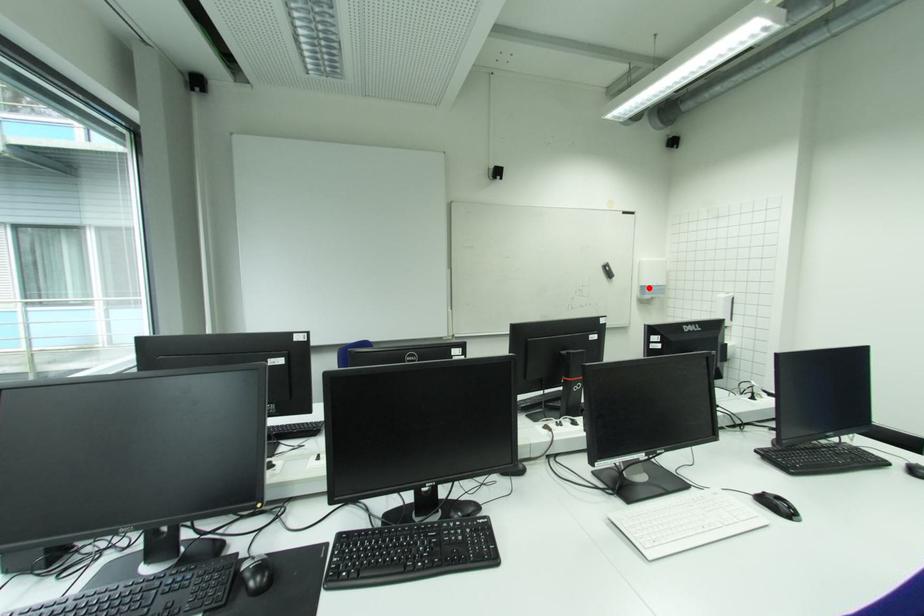
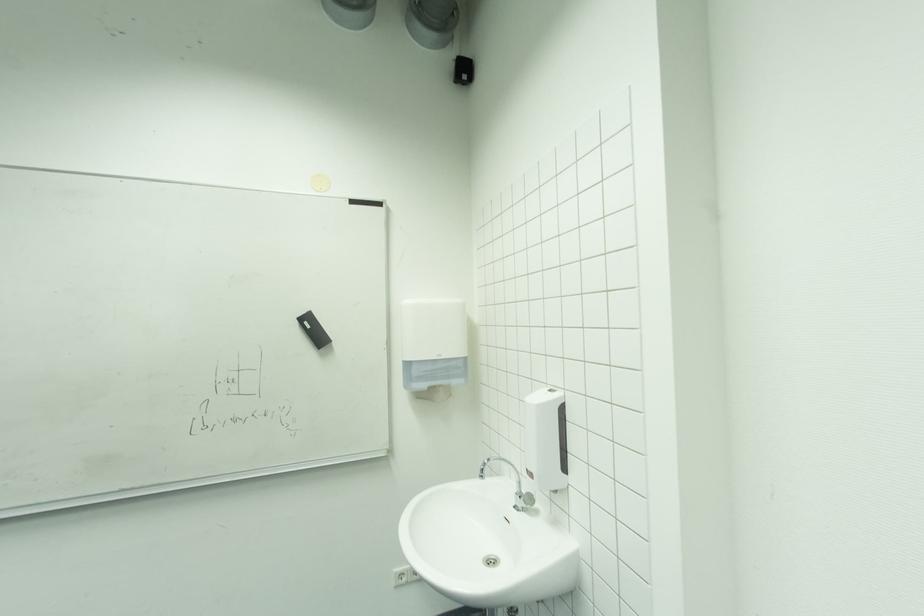
In the second image, find the point that corresponds to the highlighted location in the first image.

(412, 365)